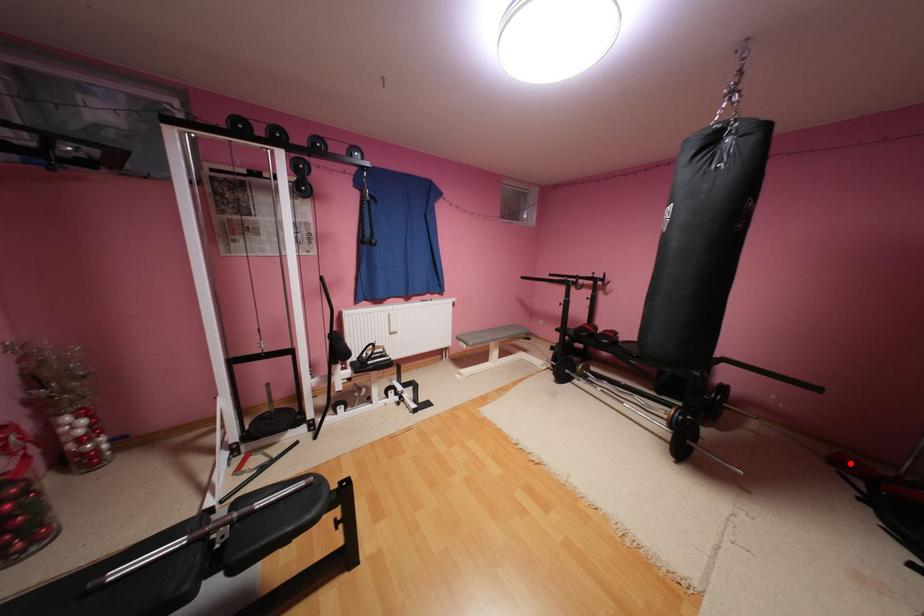
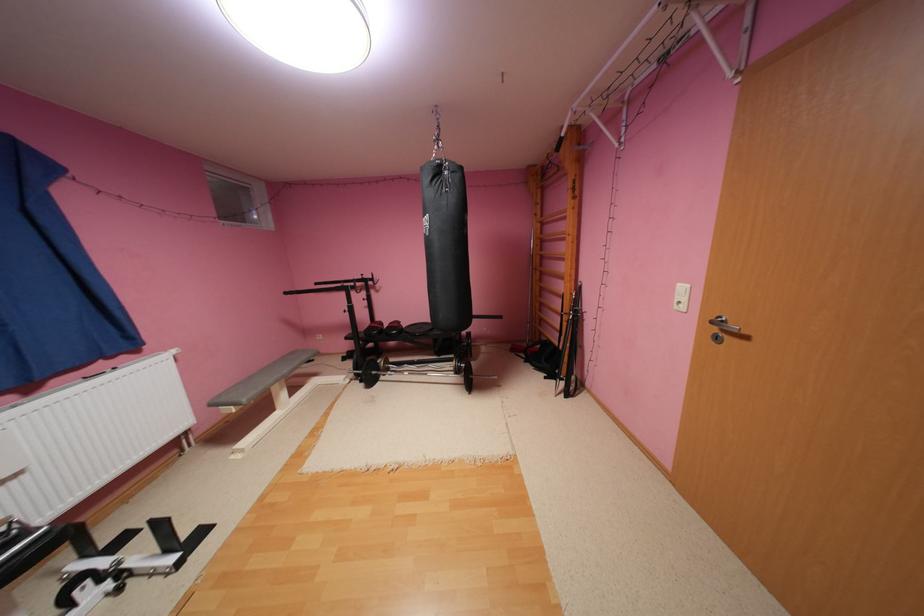
In the second image, find the point that corresponds to the highlighted location in the first image.

(524, 350)